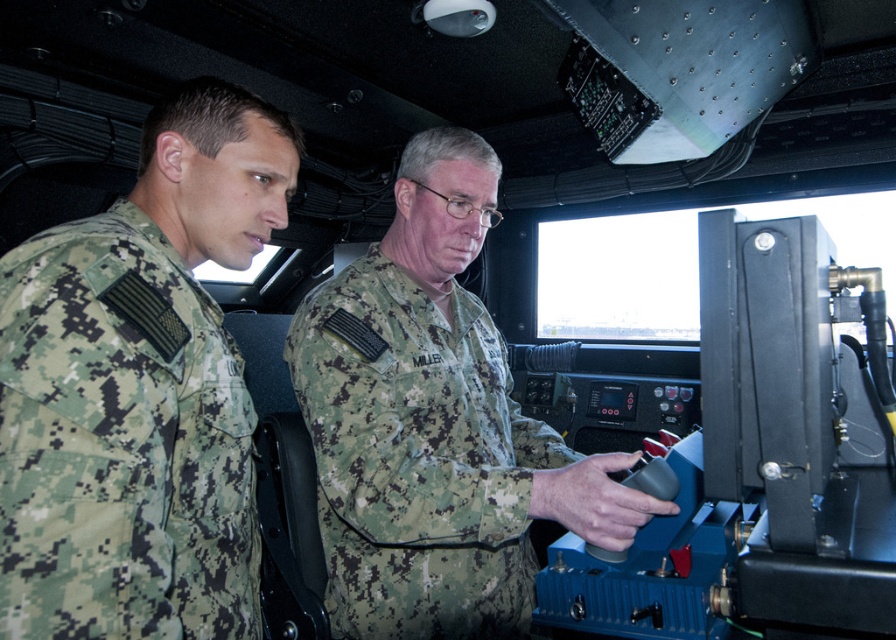
Based on the photo, which is above, camouflage uniform at left or camouflage fabric uniform at center?

camouflage uniform at left is higher up.

Is camouflage uniform at left wider than camouflage fabric uniform at center?

No.

At what (x,y) coordinates should I click in order to perform the action: click on camouflage uniform at left. Please return your answer as a coordinate pair (x, y). The width and height of the screenshot is (896, 640). Looking at the image, I should click on (139, 388).